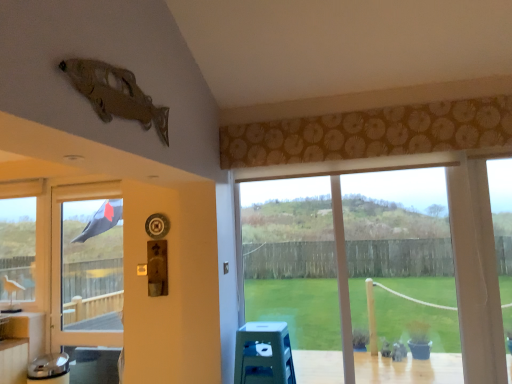
Question: From a real-world perspective, is transparent glass window at center, the 1th window when ordered from front to back, located beneath blue plastic stool at lower center?

Choices:
 (A) yes
 (B) no

Answer: (B)

Question: Considering the relative positions of transparent glass window at center, marked as the second window in a left-to-right arrangement, and blue plastic stool at lower center in the image provided, is transparent glass window at center, marked as the second window in a left-to-right arrangement, in front of blue plastic stool at lower center?

Choices:
 (A) yes
 (B) no

Answer: (B)

Question: Is transparent glass window at center, the 1th window when ordered from front to back, bigger than blue plastic stool at lower center?

Choices:
 (A) no
 (B) yes

Answer: (B)

Question: Considering the relative positions of transparent glass window at center, positioned as the 1th window in right-to-left order, and blue plastic stool at lower center in the image provided, is transparent glass window at center, positioned as the 1th window in right-to-left order, to the left of blue plastic stool at lower center from the viewer's perspective?

Choices:
 (A) no
 (B) yes

Answer: (A)

Question: From the image's perspective, does transparent glass window at center, positioned as the 1th window in right-to-left order, appear higher than blue plastic stool at lower center?

Choices:
 (A) yes
 (B) no

Answer: (A)

Question: From their relative heights in the image, would you say transparent glass window at center, the second window viewed from the back, is taller or shorter than blue plastic stool at lower center?

Choices:
 (A) short
 (B) tall

Answer: (B)

Question: Considering the positions of point (422, 178) and point (276, 334), is point (422, 178) closer or farther from the camera than point (276, 334)?

Choices:
 (A) farther
 (B) closer

Answer: (A)

Question: Choose the correct answer: Is transparent glass window at center, the 1th window when ordered from front to back, inside blue plastic stool at lower center or outside it?

Choices:
 (A) inside
 (B) outside

Answer: (B)

Question: Looking at their shapes, would you say transparent glass window at center, the second window viewed from the back, is wider or thinner than blue plastic stool at lower center?

Choices:
 (A) thin
 (B) wide

Answer: (A)

Question: Is black fabric screen door at left bigger or smaller than blue plastic stool at lower center?

Choices:
 (A) big
 (B) small

Answer: (A)

Question: From a real-world perspective, is black fabric screen door at left physically located above or below blue plastic stool at lower center?

Choices:
 (A) below
 (B) above

Answer: (B)

Question: In terms of width, does black fabric screen door at left look wider or thinner when compared to blue plastic stool at lower center?

Choices:
 (A) wide
 (B) thin

Answer: (B)

Question: Considering their positions, is black fabric screen door at left located in front of or behind blue plastic stool at lower center?

Choices:
 (A) front
 (B) behind

Answer: (B)

Question: Is black fabric screen door at left in front of or behind clear glass window at left, arranged as the second window when viewed from the front, in the image?

Choices:
 (A) behind
 (B) front

Answer: (B)

Question: From a real-world perspective, is black fabric screen door at left positioned above or below clear glass window at left, arranged as the second window when viewed from the front?

Choices:
 (A) above
 (B) below

Answer: (B)